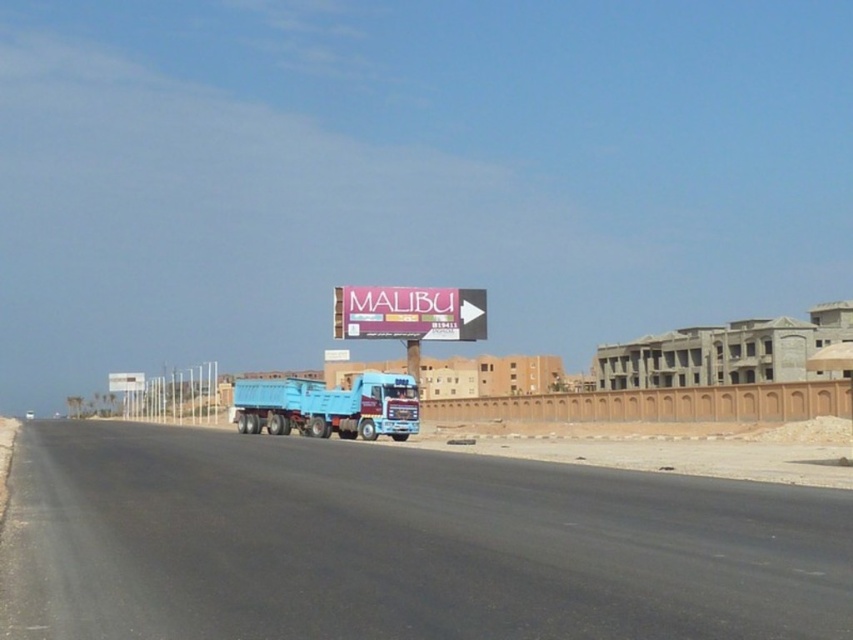
Question: Estimate the real-world distances between objects in this image. Which object is farther from the purple matte billboard at center?

Choices:
 (A) black asphalt highway at center
 (B) blue matte truck at center

Answer: (A)

Question: Is black asphalt highway at center positioned at the back of blue matte truck at center?

Choices:
 (A) no
 (B) yes

Answer: (A)

Question: Can you confirm if black asphalt highway at center is positioned to the right of purple matte billboard at center?

Choices:
 (A) yes
 (B) no

Answer: (B)

Question: Which point is closer to the camera?

Choices:
 (A) purple matte billboard at center
 (B) blue matte truck at center

Answer: (B)

Question: Among these points, which one is farthest from the camera?

Choices:
 (A) (616, 484)
 (B) (445, 289)
 (C) (407, 432)

Answer: (B)

Question: Can you confirm if black asphalt highway at center is wider than purple matte billboard at center?

Choices:
 (A) yes
 (B) no

Answer: (A)